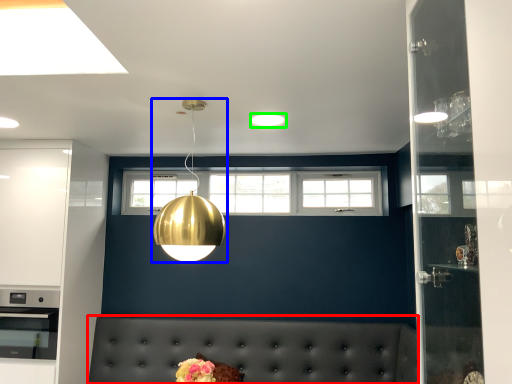
Question: Based on their relative distances, which object is farther from couch (highlighted by a red box)? Choose from lamp (highlighted by a blue box) and lighting (highlighted by a green box).

Choices:
 (A) lamp
 (B) lighting

Answer: (B)